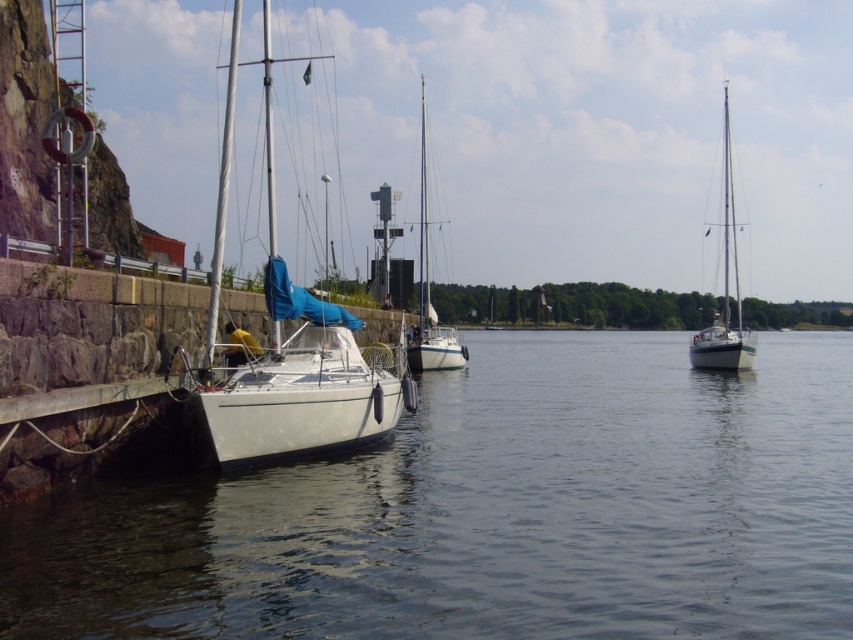
Question: Which point is closer to the camera?

Choices:
 (A) (438, 333)
 (B) (341, 547)
 (C) (247, 360)
 (D) (726, 176)

Answer: (B)

Question: Does white matte sailboat at left appear on the right side of white glossy sailboat at center?

Choices:
 (A) yes
 (B) no

Answer: (B)

Question: From the image, what is the correct spatial relationship of clear water at dock left in relation to white glossy sailboat at right?

Choices:
 (A) right
 (B) left

Answer: (B)

Question: Which of the following is the closest to the observer?

Choices:
 (A) white matte sailboat at left
 (B) white glossy sailboat at center
 (C) clear water at dock left

Answer: (C)

Question: Can you confirm if white glossy sailboat at right is positioned below white glossy sailboat at center?

Choices:
 (A) no
 (B) yes

Answer: (B)

Question: Which object is closer to the camera taking this photo?

Choices:
 (A) white glossy sailboat at center
 (B) white matte sailboat at left
 (C) clear water at dock left

Answer: (C)